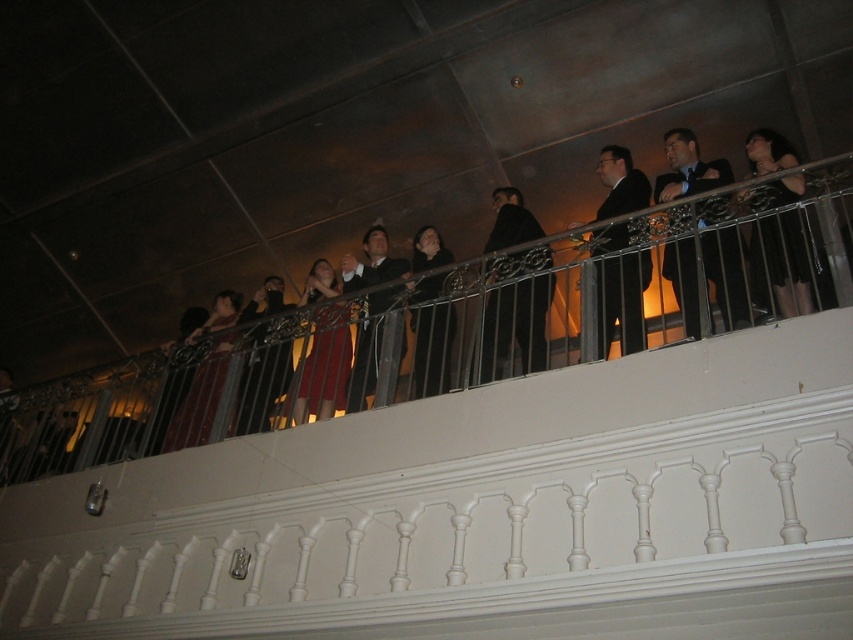
Question: Can you confirm if dark brown leather jacket at center is thinner than dark suit at center?

Choices:
 (A) yes
 (B) no

Answer: (A)

Question: Is dark brown leather jacket at center smaller than black satin dress at upper right?

Choices:
 (A) yes
 (B) no

Answer: (B)

Question: Which object appears farthest from the camera in this image?

Choices:
 (A) black satin dress at upper right
 (B) matte black robe at center

Answer: (B)

Question: Does shiny red dress at center appear under velvet red dress at center?

Choices:
 (A) yes
 (B) no

Answer: (B)

Question: Among these objects, which one is farthest from the camera?

Choices:
 (A) velvet red dress at center
 (B) dark suit at upper right

Answer: (A)

Question: Considering the real-world distances, which object is closest to the dark suit at center?

Choices:
 (A) matte black suit at center
 (B) dark suit at upper right

Answer: (A)